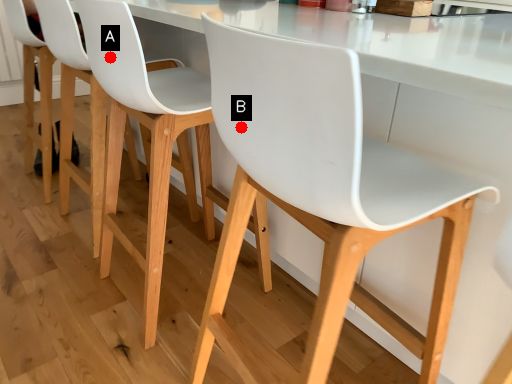
Question: Two points are circled on the image, labeled by A and B beside each circle. Which of the following is the closest to the observer?

Choices:
 (A) A is closer
 (B) B is closer

Answer: (B)